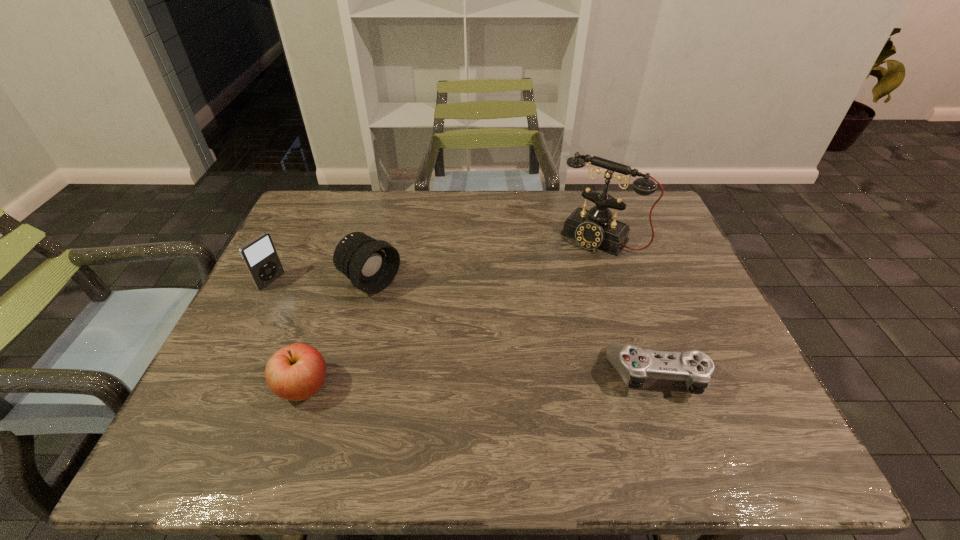
What are the coordinates of `vacant region that satisfies the following two spatial constraints: 1. on the back side of the telephoto lens; 2. on the right side of the apple` in the screenshot? It's located at coord(339,282).